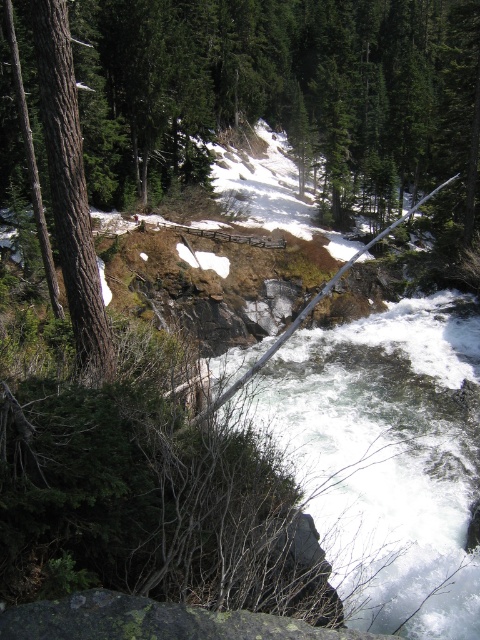
You are a hiker trying to cross the river using a narrow path. You see the brown rough tree at center and the white frothy water at center. Which object is closer to you, the hiker?

The brown rough tree at center is closer to you because the white frothy water at center is behind it.

You are navigating a small boat along the river in this scene. You notice two points marked on your map at coordinates point (210, 35) and point (459, 515). Which point is closer to your current position if you are facing downstream?

Point (459, 515) is closer to your current position because it is in front of point (210, 35) when facing downstream.